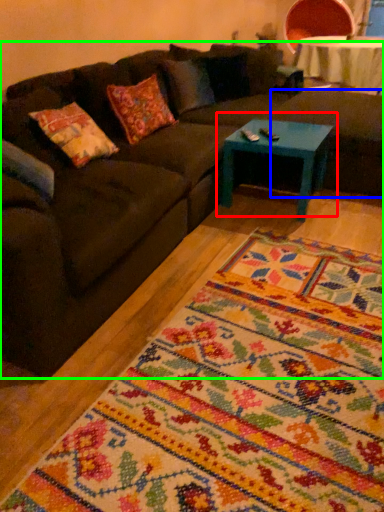
Question: Based on their relative distances, which object is nearer to coffee table (highlighted by a red box)? Choose from footrest (highlighted by a blue box) and studio couch (highlighted by a green box).

Choices:
 (A) footrest
 (B) studio couch

Answer: (A)